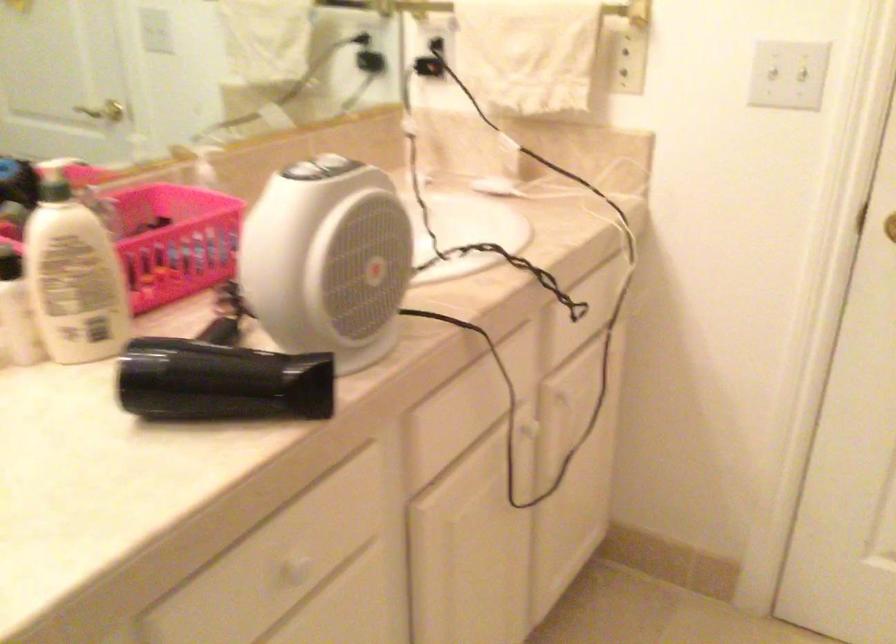
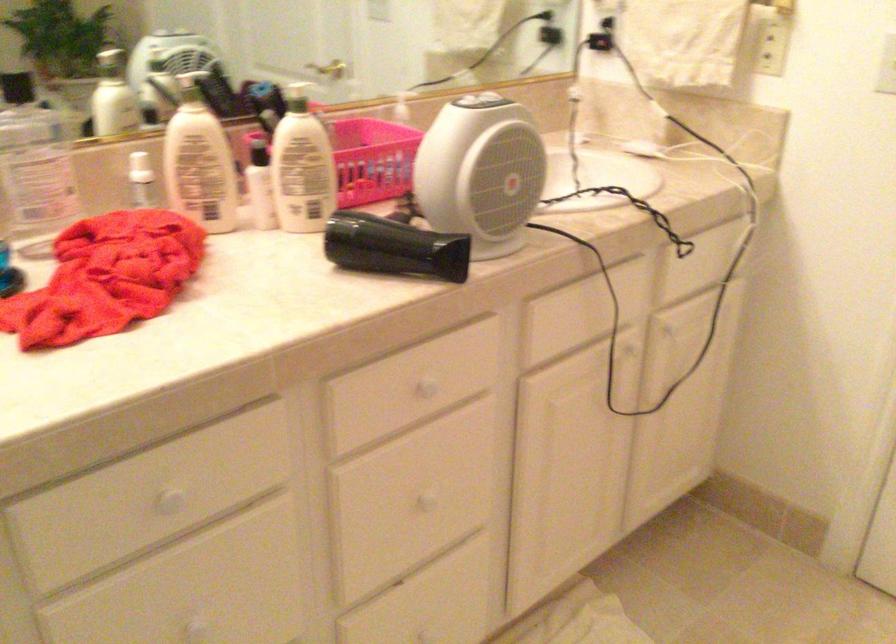
The point at (104, 108) is marked in the first image. Where is the corresponding point in the second image?

(329, 69)